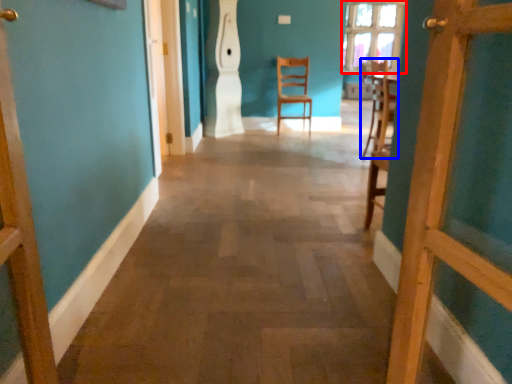
Question: Which of the following is the closest to the observer, window (highlighted by a red box) or chair (highlighted by a blue box)?

Choices:
 (A) window
 (B) chair

Answer: (B)